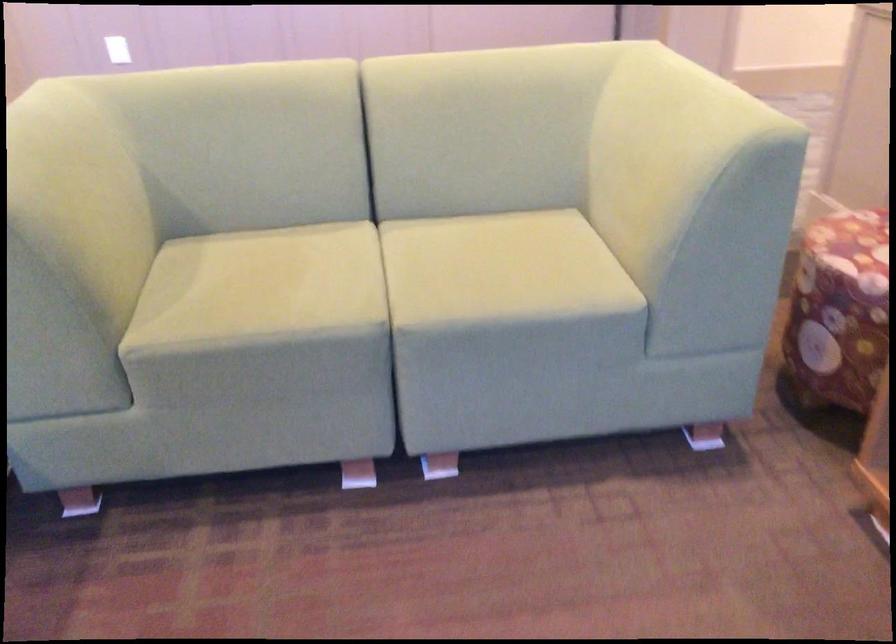
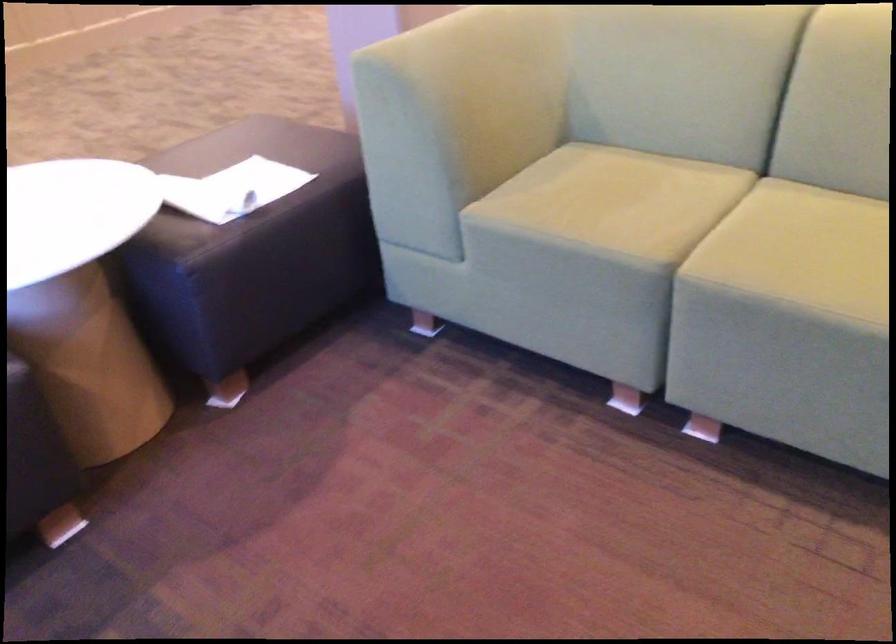
The point at (300, 279) is marked in the first image. Where is the corresponding point in the second image?

(636, 202)